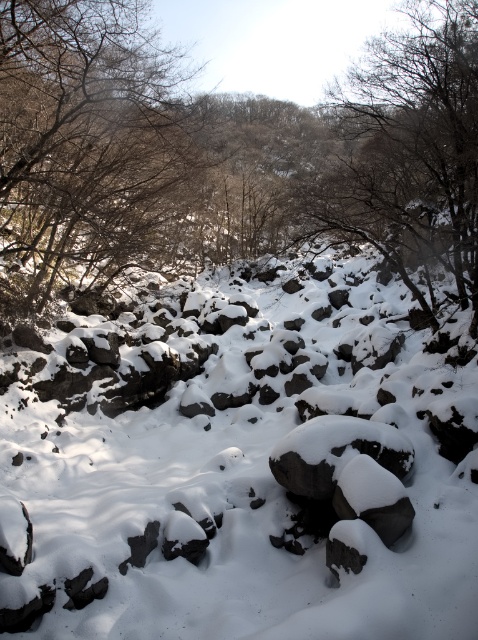
Question: Can you confirm if brown/dry wood at left is positioned above bare branches at upper right?

Choices:
 (A) yes
 (B) no

Answer: (B)

Question: Observing the image, what is the correct spatial positioning of white matte snow at center in reference to bare branches at upper right?

Choices:
 (A) above
 (B) below

Answer: (B)

Question: Which point is closer to the camera taking this photo?

Choices:
 (A) (171, 461)
 (B) (457, 147)

Answer: (B)

Question: Which of the following is the closest to the observer?

Choices:
 (A) white matte snow at center
 (B) brown/dry wood at left

Answer: (A)

Question: Is brown/dry wood at left positioned before bare branches at upper right?

Choices:
 (A) yes
 (B) no

Answer: (A)

Question: Which of these objects is positioned farthest from the brown/dry wood at left?

Choices:
 (A) white matte snow at center
 (B) bare branches at upper right

Answer: (B)